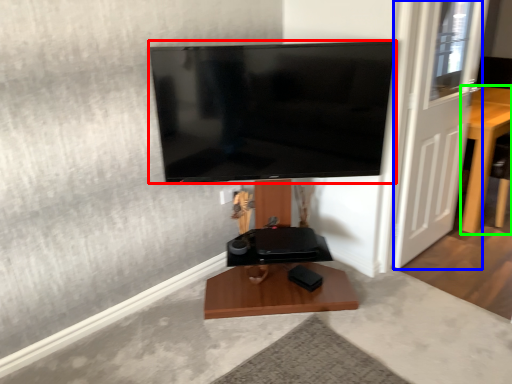
Question: Estimate the real-world distances between objects in this image. Which object is farther from television (highlighted by a red box), door (highlighted by a blue box) or furniture (highlighted by a green box)?

Choices:
 (A) door
 (B) furniture

Answer: (B)